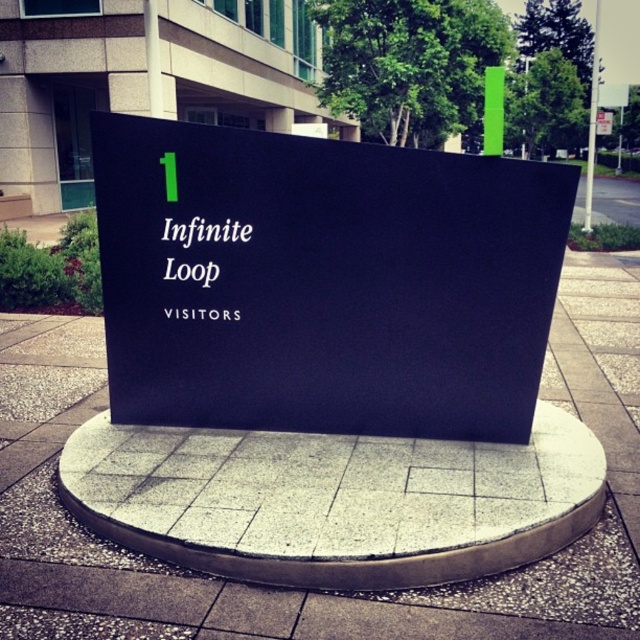
You are standing in front of the sign and want to place a small flag at the point that is closer to you. Which point should you choose between point [193,259] and point [205,269]?

A: You should choose point [193,259] because it is closer to the viewer than point [205,269].

You are an architect designing a new building and need to ensure the height of the black matte sign at center and white matte sign at center aligns with the building design. Which sign is taller?

The black matte sign at center has a greater height compared to the white matte sign at center, so the black matte sign at center is taller.

You are standing in front of the sign and want to read both the black matte sign at center and the white matte sign at center. Which one do you need to look down at first?

The black matte sign at center is located below the white matte sign at center, so you need to look down at the black matte sign at center first after looking at the white matte sign at center.